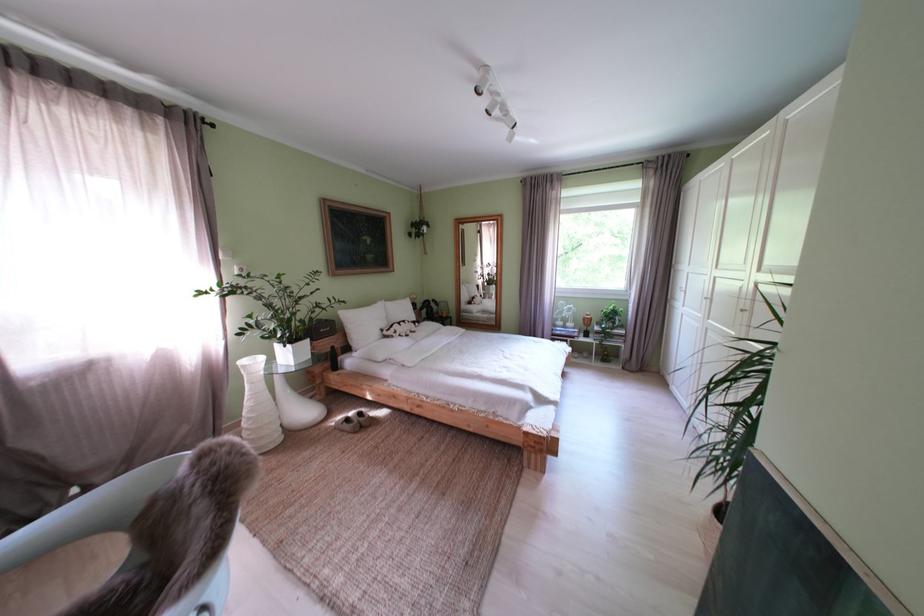
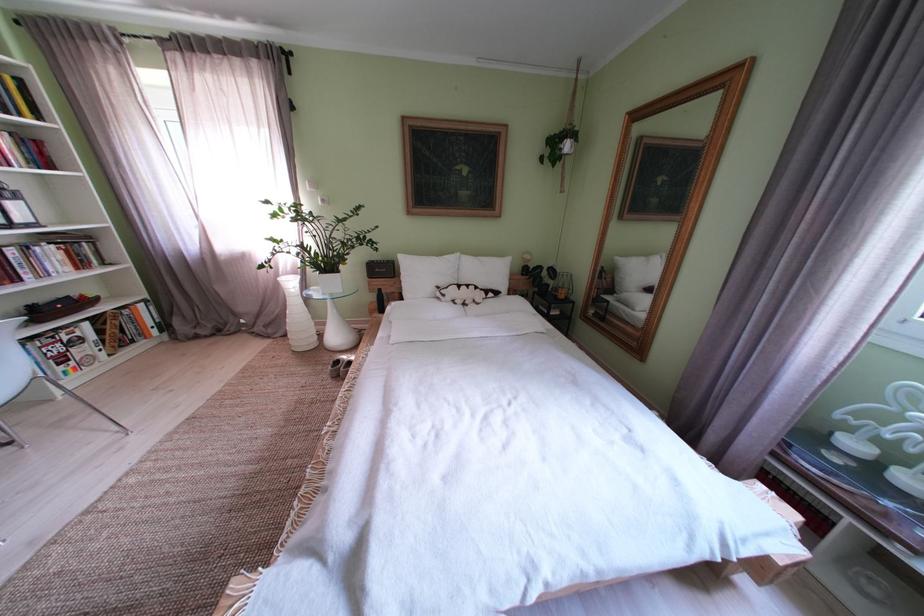
Locate, in the second image, the point that corresponds to [301,349] in the first image.

(333, 278)